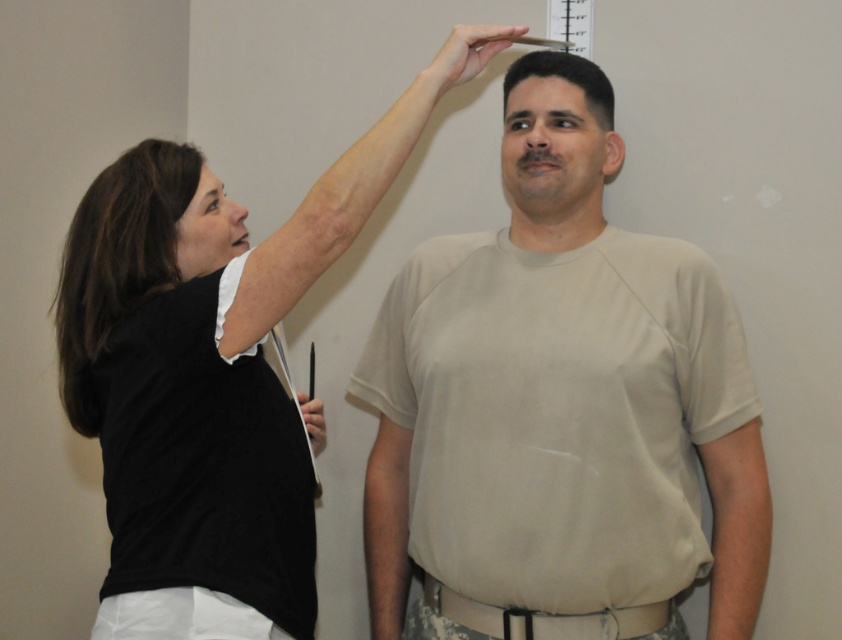
Is beige cotton shirt at center thinner than black fabric belt at center?

No, beige cotton shirt at center is not thinner than black fabric belt at center.

Where is `beige cotton shirt at center`? beige cotton shirt at center is located at coordinates (558, 406).

Is black matte shirt at upper left smaller than black fabric belt at center?

Actually, black matte shirt at upper left might be larger than black fabric belt at center.

Between point (273, 419) and point (598, 628), which one is positioned behind?

Positioned behind is point (598, 628).

Identify the location of black matte shirt at upper left. (212, 356).

How distant is beige cotton shirt at center from black matte shirt at upper left?

beige cotton shirt at center is 14.57 inches away from black matte shirt at upper left.

This screenshot has height=640, width=842. What do you see at coordinates (558, 406) in the screenshot? I see `beige cotton shirt at center` at bounding box center [558, 406].

Where is `beige cotton shirt at center`? beige cotton shirt at center is located at coordinates pos(558,406).

Locate an element on the screen. Image resolution: width=842 pixels, height=640 pixels. beige cotton shirt at center is located at coordinates (558, 406).